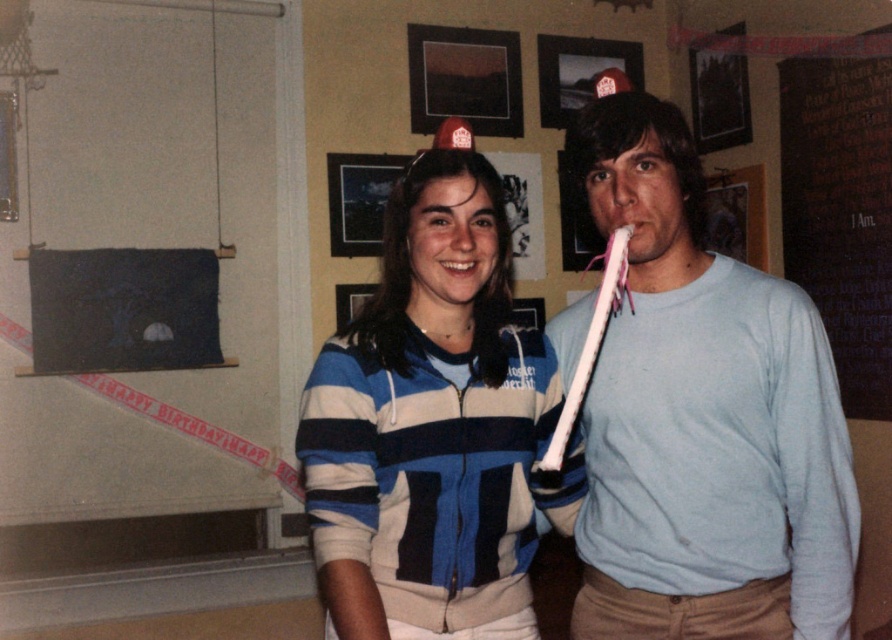
Is light blue cotton shirt at center taller than blue striped hoodie at center?

Yes.

Between point (804, 429) and point (380, 538), which one is positioned in front?

Positioned in front is point (380, 538).

Is point (624, 573) positioned behind point (484, 257)?

Yes, it is.

Locate an element on the screen. The width and height of the screenshot is (892, 640). light blue cotton shirt at center is located at coordinates (703, 419).